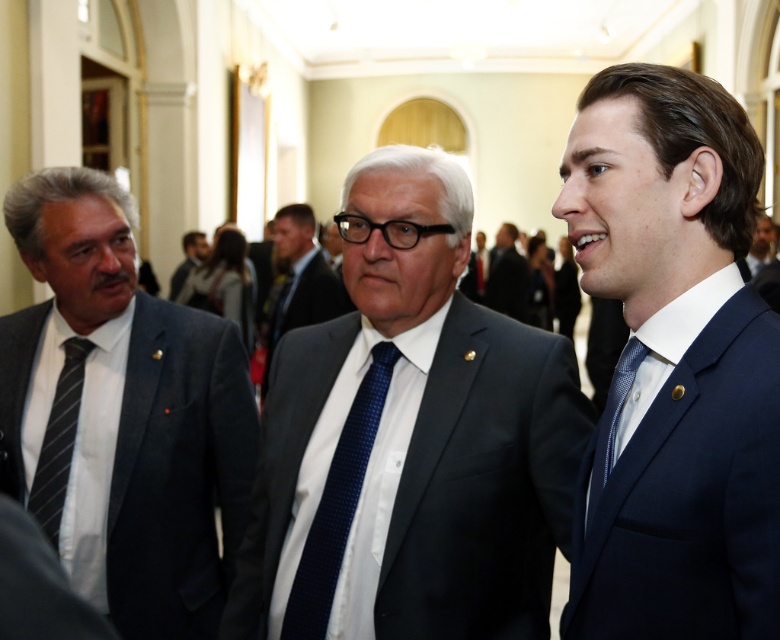
Can you confirm if blue textured tie at center is shorter than dark blue suit at center?

Correct, blue textured tie at center is not as tall as dark blue suit at center.

Is blue textured tie at center smaller than dark blue suit at center?

Yes, blue textured tie at center is smaller than dark blue suit at center.

What do you see at coordinates (337, 502) in the screenshot? The height and width of the screenshot is (640, 780). I see `blue textured tie at center` at bounding box center [337, 502].

Where is `blue textured tie at center`? The width and height of the screenshot is (780, 640). blue textured tie at center is located at coordinates (337, 502).

In the scene shown: Can you confirm if matte black suit at center is positioned to the left of blue textured tie at center?

In fact, matte black suit at center is to the right of blue textured tie at center.

Who is taller, matte black suit at center or blue textured tie at center?

matte black suit at center is taller.

Is point (502, 560) closer to camera compared to point (317, 621)?

No, it is not.

Locate an element on the screen. This screenshot has height=640, width=780. matte black suit at center is located at coordinates tap(415, 435).

Between navy blue suit at right and light brown leather jacket at center, which one is positioned lower?

navy blue suit at right

Which is in front, point (582, 602) or point (183, 241)?

Point (582, 602) is in front.

Identify the location of navy blue suit at right. (672, 364).